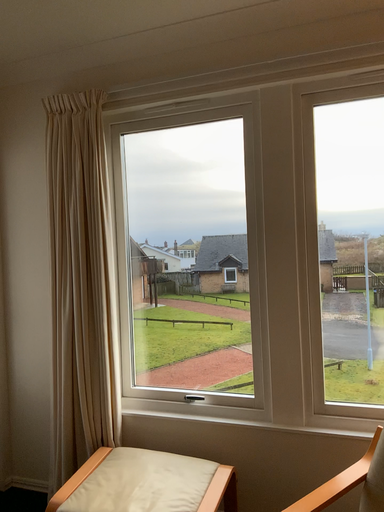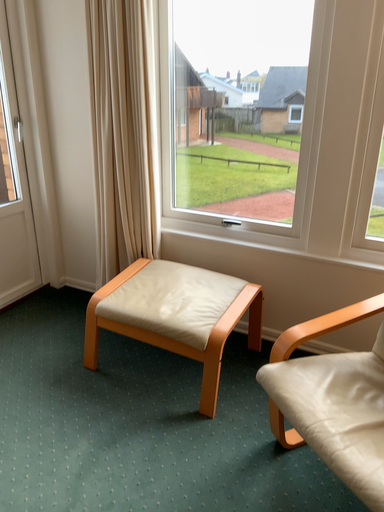
Question: How did the camera likely rotate when shooting the video?

Choices:
 (A) rotated downward
 (B) rotated upward

Answer: (A)